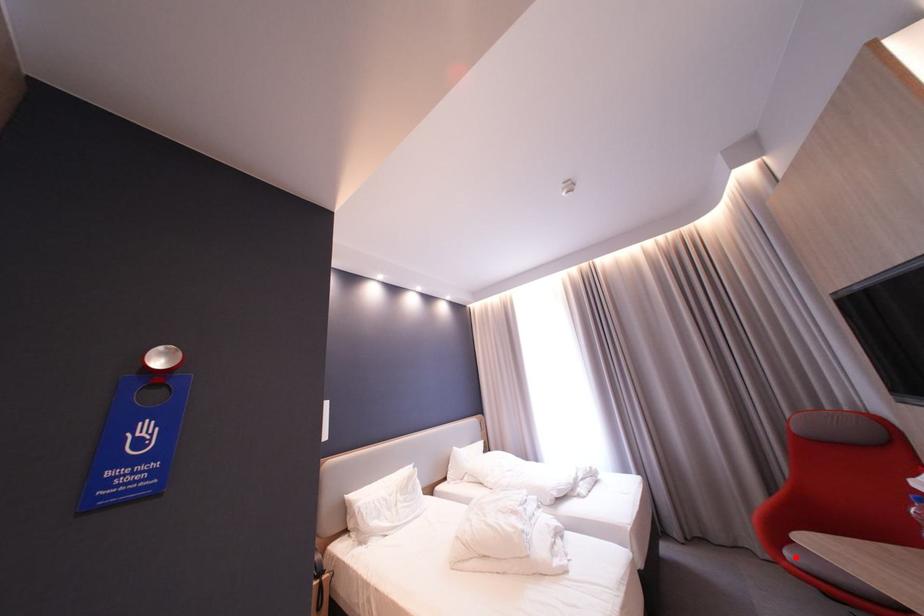
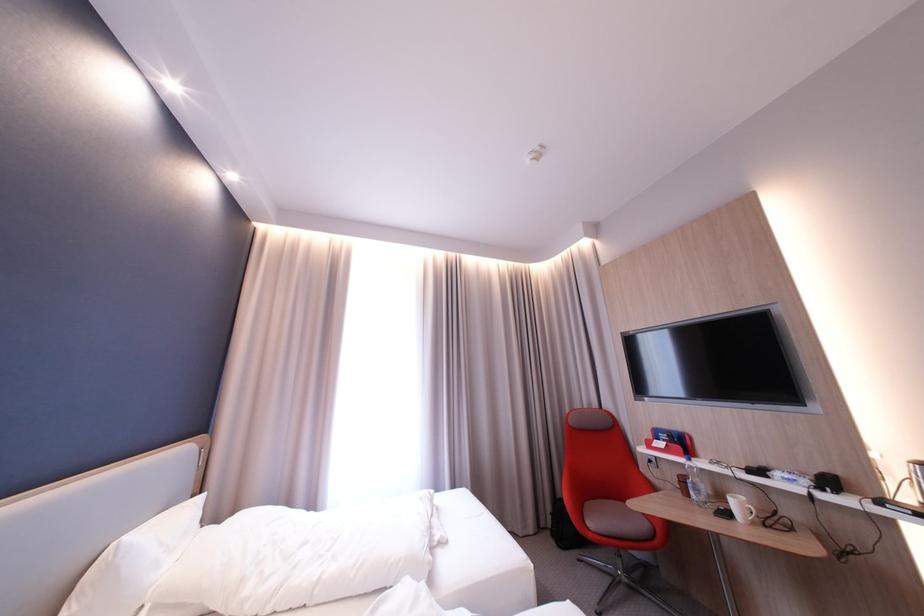
Question: I am providing you with two images of the same scene from different viewpoints. Image1 has a red point marked. In image2, the corresponding 3D location appears at what relative position? Reply with the corresponding letter.

Choices:
 (A) Closer
 (B) Farther

Answer: (B)